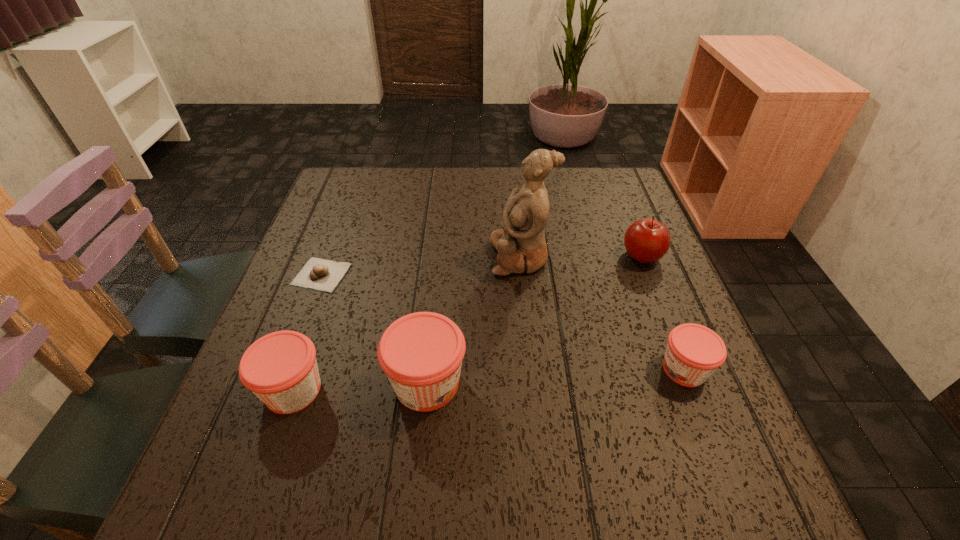
Locate an element on the screen. This screenshot has height=540, width=960. empty location between the third object from right to left and the second shortest object is located at coordinates (603, 313).

This screenshot has width=960, height=540. Find the location of `vacant region between the fourth object from right to left and the tallest object`. vacant region between the fourth object from right to left and the tallest object is located at coordinates (473, 320).

Locate an element on the screen. The image size is (960, 540). free space between the second jam from right to left and the garlic is located at coordinates (374, 329).

Locate an element on the screen. The width and height of the screenshot is (960, 540). unoccupied position between the shortest object and the apple is located at coordinates (482, 266).

In order to click on free point between the second jam from right to left and the fifth tallest object in this screenshot , I will do `click(556, 376)`.

Find the location of a particular element. The height and width of the screenshot is (540, 960). vacant space that is in between the garlic and the tallest object is located at coordinates (420, 266).

Image resolution: width=960 pixels, height=540 pixels. I want to click on empty location between the second shortest jam and the third object from left to right, so click(360, 386).

What are the coordinates of `vacant space in between the leftmost jam and the garlic` in the screenshot? It's located at (307, 332).

The image size is (960, 540). What are the coordinates of `object that ranks as the fourth closest to the shortest jam` in the screenshot? It's located at (280, 368).

Select which object appears as the third closest to the second shortest jam. Please provide its 2D coordinates. Your answer should be formatted as a tuple, i.e. [(x, y)], where the tuple contains the x and y coordinates of a point satisfying the conditions above.

[(521, 245)]